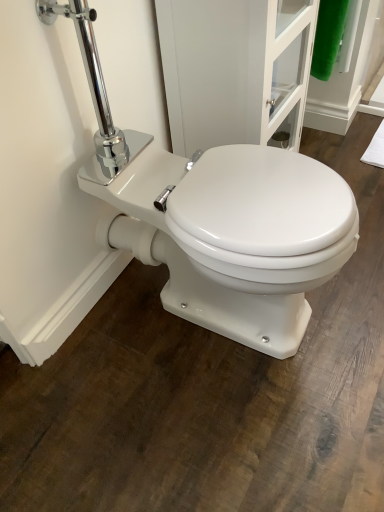
Question: From a real-world perspective, is white glossy screen door at center positioned above or below white glossy toilet at center?

Choices:
 (A) above
 (B) below

Answer: (A)

Question: Considering the positions of white glossy screen door at center and white glossy toilet at center in the image, is white glossy screen door at center bigger or smaller than white glossy toilet at center?

Choices:
 (A) big
 (B) small

Answer: (B)

Question: Is point (180, 146) closer or farther from the camera than point (289, 328)?

Choices:
 (A) closer
 (B) farther

Answer: (B)

Question: Is white glossy toilet at center wider or thinner than white glossy screen door at center?

Choices:
 (A) thin
 (B) wide

Answer: (B)

Question: From a real-world perspective, relative to white glossy screen door at center, is white glossy toilet at center vertically above or below?

Choices:
 (A) above
 (B) below

Answer: (B)

Question: From the image's perspective, is white glossy toilet at center positioned above or below white glossy screen door at center?

Choices:
 (A) below
 (B) above

Answer: (A)

Question: Considering the positions of point (187, 182) and point (173, 134), is point (187, 182) closer or farther from the camera than point (173, 134)?

Choices:
 (A) closer
 (B) farther

Answer: (A)